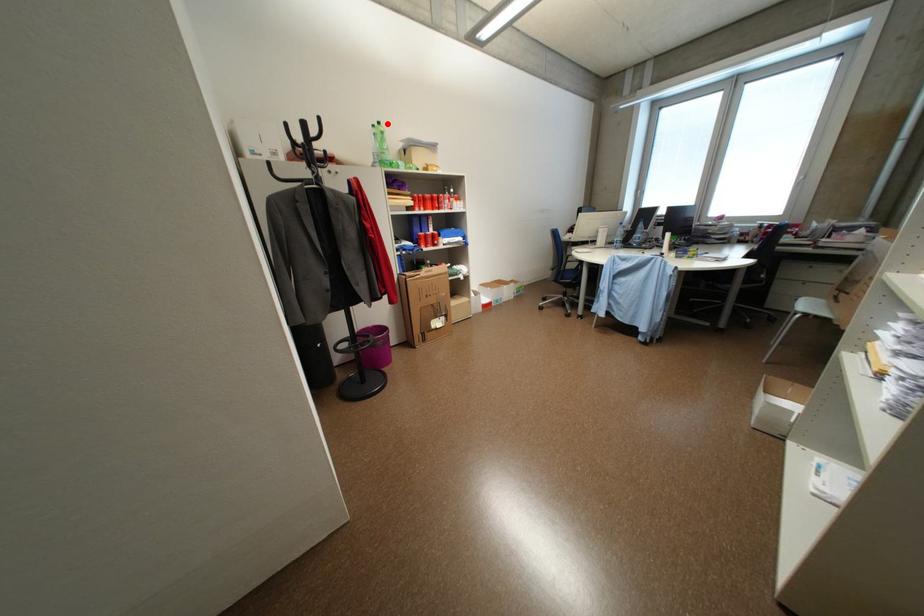
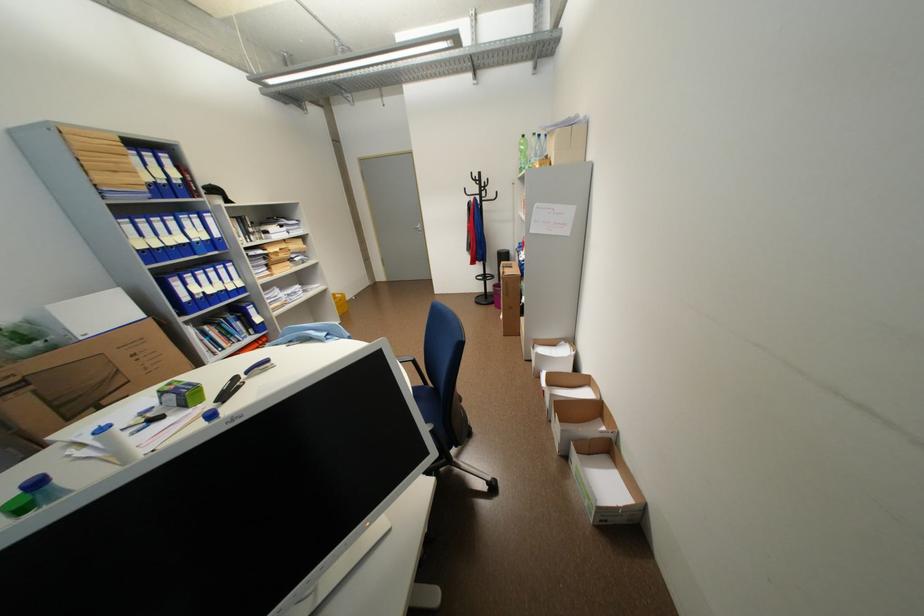
Find the pixel in the second image that matches the highlighted location in the first image.

(531, 137)